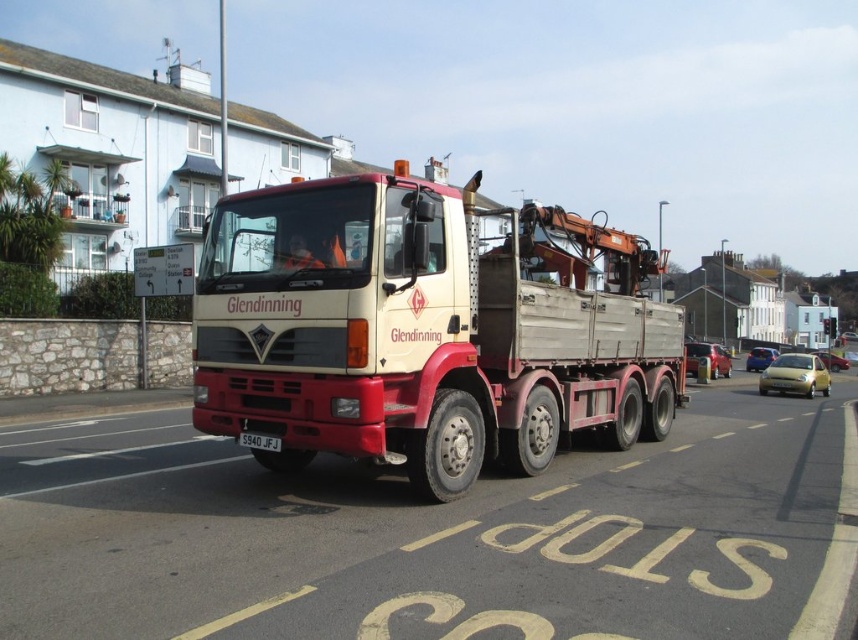
You are a delivery driver who needs to park your matte white truck at center in a parking spot that is exactly the width of your truck. You see a white plastic license plate at center in the parking lot. Can you use the license plate at center to determine if the parking spot is wide enough for your truck?

The matte white truck at center is wider than the white plastic license plate at center, so the license plate cannot accurately determine if the parking spot is wide enough for the truck since it is narrower than the truck.

You are standing at the stop sign and looking at the truck. There are two points marked on the truck, one at coordinates point [784,355] and another at point [273,440]. Which point is closer to you?

Point [273,440] is closer to you because it is nearer to the camera compared to point [784,355], which is further away.